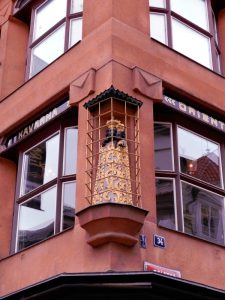
The height and width of the screenshot is (300, 225). I want to click on statue base, so click(x=91, y=210), click(x=134, y=212), click(x=127, y=232), click(x=99, y=231).